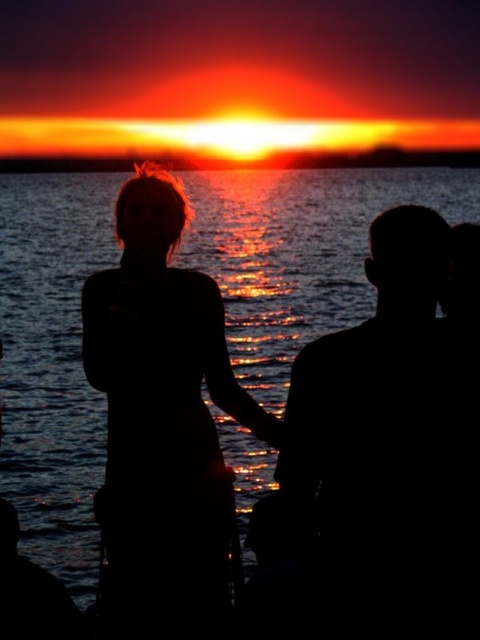
You are a photographer trying to capture the sunset. You want to ensure both the glistening water at center and the sunset sky at center are in focus. Given that your camera has a depth of field that can cover 200 feet, will both objects be in focus?

The distance between the glistening water at center and the sunset sky at center is 225.16 feet, which exceeds the camera depth of field of 200 feet. Therefore, both objects cannot be in focus simultaneously.

You are a photographer trying to capture the sunset scene. You notice the glistening water at center and the silhouette hair at center. Which object should you focus on if you want to highlight the reflection of the sunset?

The glistening water at center is above the silhouette hair at center and reflects the sunset, so focusing on the glistening water at center would best highlight the reflection.

You are observing the sunset scene and notice two points marked in the image. The first point is at coordinates point (151, 490) and the second is at point (46, 160). Which of these points is nearer to you as the viewer?

Point (151, 490) is closer to the viewer than point (46, 160).